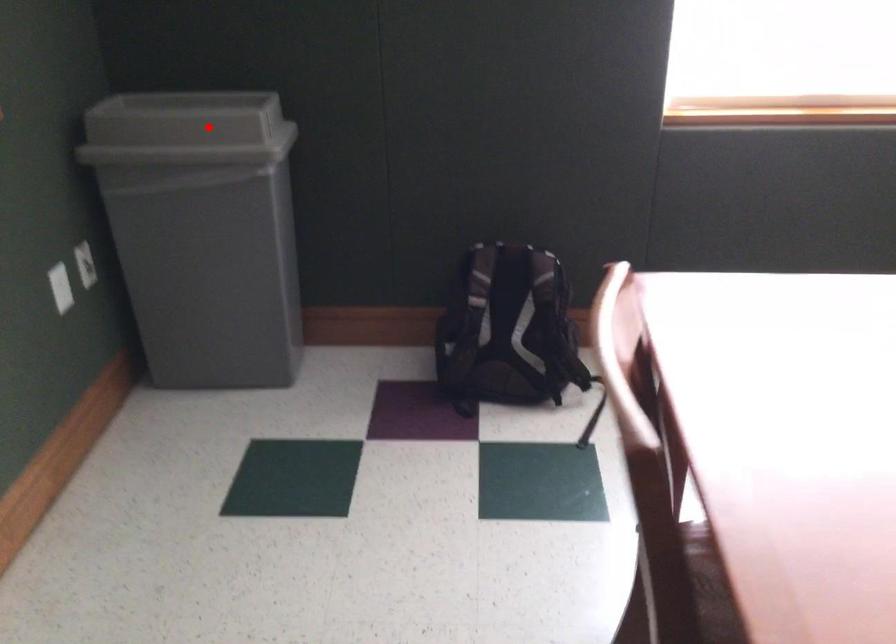
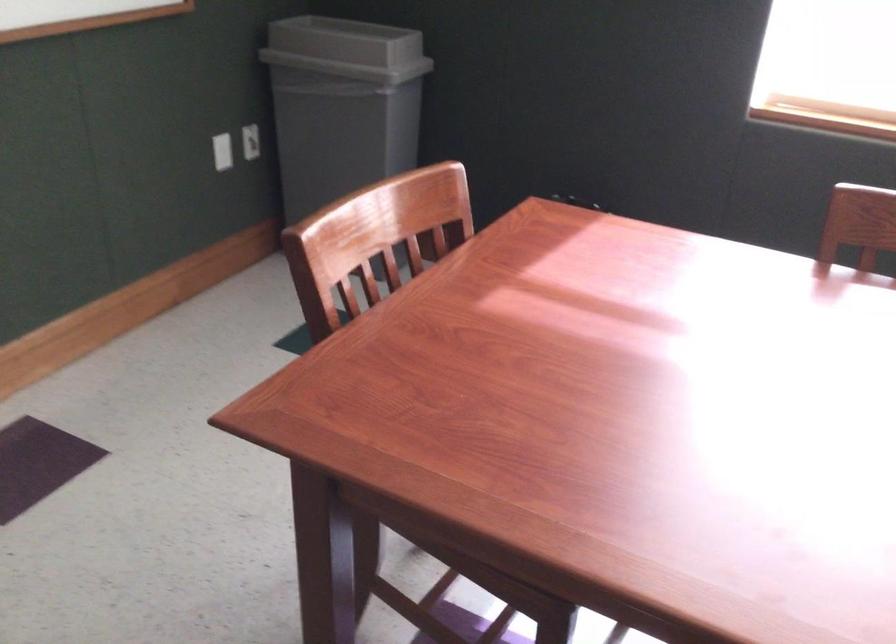
Question: I am providing you with two images of the same scene from different viewpoints. Image1 has a red point marked. In image2, the corresponding 3D location appears at what relative position? Reply with the corresponding letter.

Choices:
 (A) Closer
 (B) Farther

Answer: (B)